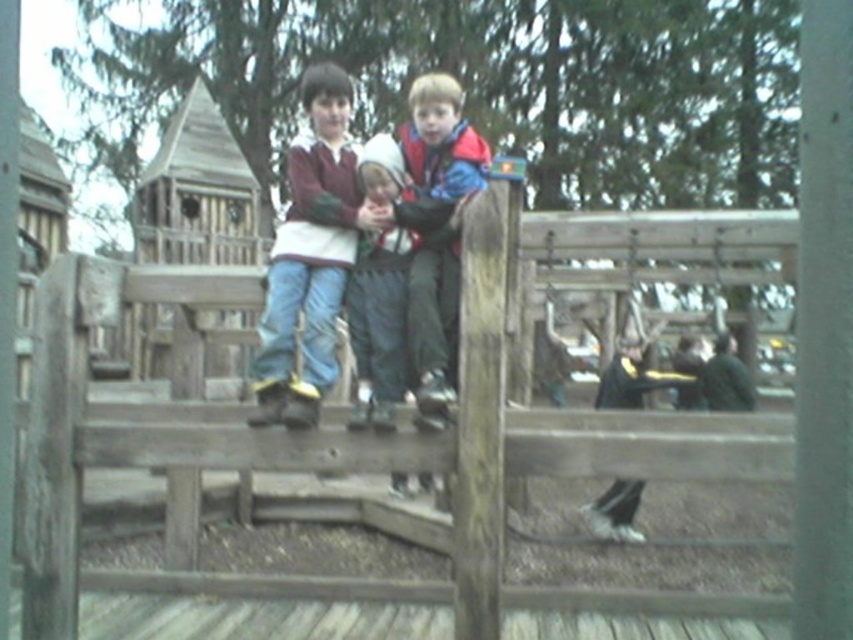
You are a parent trying to locate your child who is wearing a matte maroon sweater at center. You see the smooth gray pole at center nearby. Which object takes up more space in the image?

The matte maroon sweater at center takes up more space than the smooth gray pole at center.

You are a parent trying to decide which item to use to hang a small backpack. The smooth gray pole at center and the matte maroon sweater at center are both in your view. Which item would be more suitable for hanging the backpack?

The smooth gray pole at center is thinner than the matte maroon sweater at center, so the smooth gray pole at center would be more suitable for hanging the backpack since it is thinner and likely sturdier.

You are a parent trying to locate your child in the park. You see the smooth gray pole at center and the matte maroon sweater at center. Which object is closer to you?

The smooth gray pole at center and matte maroon sweater at center are 7.06 feet apart, so it depends on their positions relative to you. However, since both are at the center, they are equidistant from you.